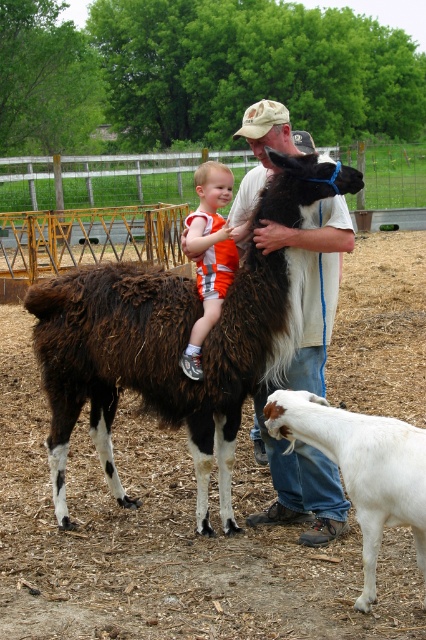
You are a farmer trying to fit a white fluffy goat at lower right and a light brown cotton shirt at center into a small pen. Which object requires more horizontal space?

The white fluffy goat at lower right requires more horizontal space because its width surpasses that of the light brown cotton shirt at center.